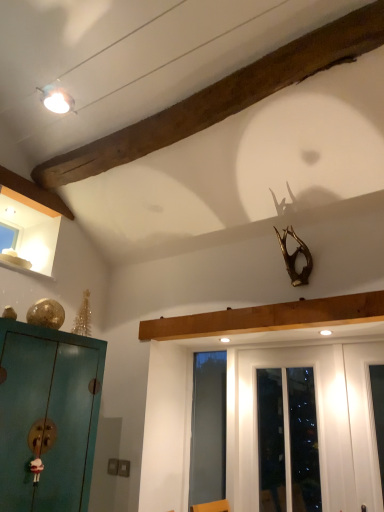
Question: Is transparent glass screen door at center further to the viewer compared to matte white light fixture at upper left?

Choices:
 (A) yes
 (B) no

Answer: (A)

Question: Considering the relative positions of transparent glass screen door at center and matte white light fixture at upper left in the image provided, is transparent glass screen door at center in front of matte white light fixture at upper left?

Choices:
 (A) no
 (B) yes

Answer: (A)

Question: Considering the relative positions of transparent glass screen door at center and matte white light fixture at upper left in the image provided, is transparent glass screen door at center to the left of matte white light fixture at upper left from the viewer's perspective?

Choices:
 (A) no
 (B) yes

Answer: (A)

Question: From the image's perspective, is transparent glass screen door at center on matte white light fixture at upper left?

Choices:
 (A) no
 (B) yes

Answer: (A)

Question: Are transparent glass screen door at center and matte white light fixture at upper left located far from each other?

Choices:
 (A) yes
 (B) no

Answer: (A)

Question: Is transparent glass screen door at center thinner than matte white light fixture at upper left?

Choices:
 (A) yes
 (B) no

Answer: (A)

Question: Is white glossy door at center a part of transparent glass screen door at center?

Choices:
 (A) yes
 (B) no

Answer: (B)

Question: From a real-world perspective, is transparent glass screen door at center positioned over white glossy door at center based on gravity?

Choices:
 (A) no
 (B) yes

Answer: (A)

Question: Is transparent glass screen door at center smaller than white glossy door at center?

Choices:
 (A) no
 (B) yes

Answer: (B)

Question: Does transparent glass screen door at center have a lesser height compared to white glossy door at center?

Choices:
 (A) no
 (B) yes

Answer: (A)

Question: Can you confirm if transparent glass screen door at center is thinner than white glossy door at center?

Choices:
 (A) yes
 (B) no

Answer: (B)

Question: Would you say transparent glass screen door at center is a long distance from white glossy door at center?

Choices:
 (A) yes
 (B) no

Answer: (B)

Question: Is transparent glass screen door at center closer to camera compared to wooden beam at upper left?

Choices:
 (A) no
 (B) yes

Answer: (A)